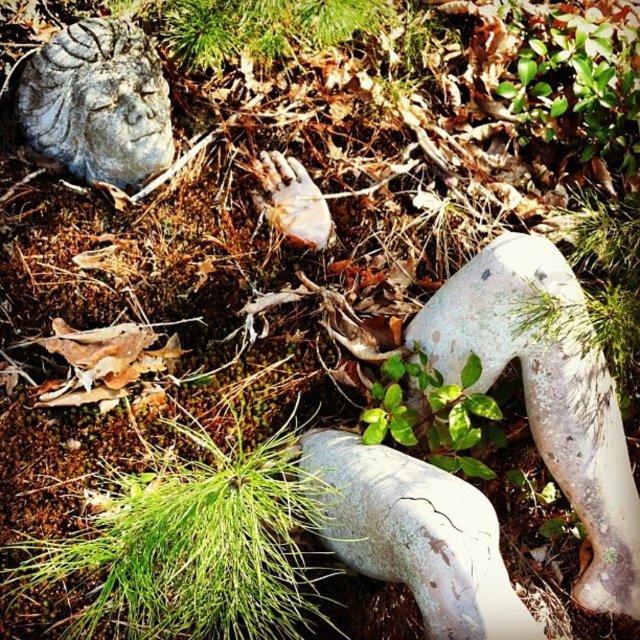
You are a gardener who wants to place a new decorative item between the cracked stone leg at center and the green leafy plant at upper right. Based on their positions, where should you place it to ensure it is between them?

The cracked stone leg at center is positioned on the left side of green leafy plant at upper right, so placing the new decorative item between them would require positioning it to the right of the cracked stone leg at center and to the left of the green leafy plant at upper right.

You are a gardener trying to decide where to place a new small statue. You see the gray stone face at upper left and the green leafy plant at upper right. Which object takes up more space in the scene?

The green leafy plant at upper right takes up more space in the scene than the gray stone face at upper left because the gray stone face at upper left is smaller than the green leafy plant at upper right.

You are a gardener trying to reach the cracked stone leg at center to clean it. There is green grass at lower left in your way. Can you move the grass to access the leg?

The cracked stone leg at center is behind green grass at lower left, so you can move the green grass at lower left to access the leg.